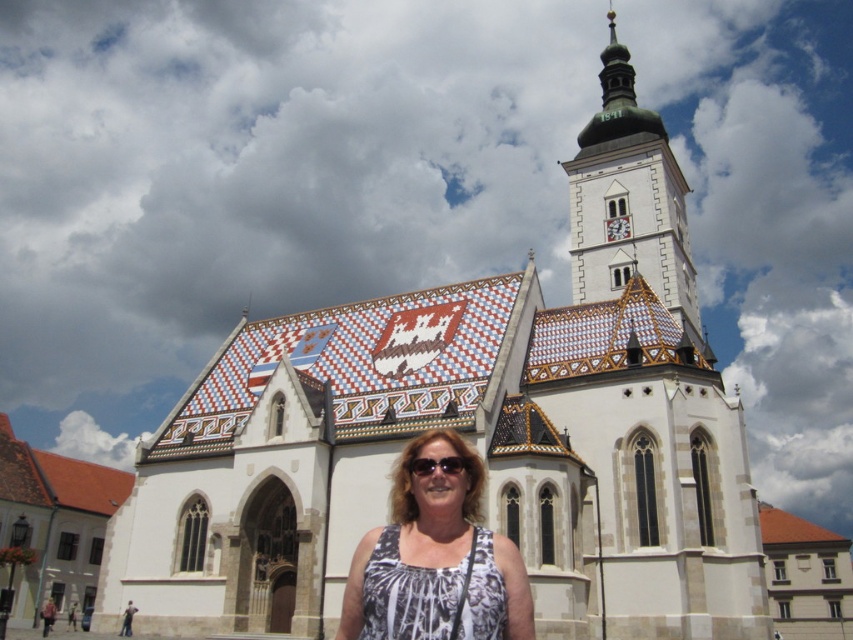
Does white printed tank top at center appear on the right side of green metallic tower at upper center?

In fact, white printed tank top at center is to the left of green metallic tower at upper center.

Which is behind, point (514, 636) or point (606, 144)?

Point (606, 144)

This screenshot has width=853, height=640. Identify the location of white printed tank top at center. (436, 561).

Does white printed tank top at center have a smaller size compared to sunglasses at center?

No, white printed tank top at center is not smaller than sunglasses at center.

Can you confirm if white printed tank top at center is wider than sunglasses at center?

Correct, the width of white printed tank top at center exceeds that of sunglasses at center.

This screenshot has width=853, height=640. In order to click on white printed tank top at center in this screenshot , I will do `click(436, 561)`.

In order to click on white printed tank top at center in this screenshot , I will do `click(436, 561)`.

Does green metallic tower at upper center come behind sunglasses at center?

Yes, green metallic tower at upper center is further from the viewer.

Measure the distance between point (569,188) and camera.

340.87 feet

Where is `green metallic tower at upper center`? green metallic tower at upper center is located at coordinates (628, 198).